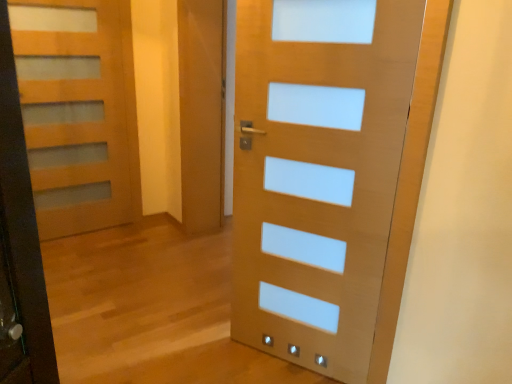
Question: Which direction should I rotate to look at matte wood door at center, marked as the first door in a front-to-back arrangement?

Choices:
 (A) left
 (B) right

Answer: (B)

Question: From the image's perspective, is matte wood door at center, acting as the second door starting from the back, below matte wood door at left, the second door viewed from the right?

Choices:
 (A) no
 (B) yes

Answer: (B)

Question: Is matte wood door at center, marked as the first door in a front-to-back arrangement, oriented towards matte wood door at left, marked as the 1th door in a left-to-right arrangement?

Choices:
 (A) no
 (B) yes

Answer: (A)

Question: Considering the relative sizes of matte wood door at center, acting as the second door starting from the back, and matte wood door at left, which appears as the 1th door when viewed from the back, in the image provided, is matte wood door at center, acting as the second door starting from the back, bigger than matte wood door at left, which appears as the 1th door when viewed from the back,?

Choices:
 (A) yes
 (B) no

Answer: (A)

Question: Is matte wood door at left, marked as the 1th door in a left-to-right arrangement, inside matte wood door at center, marked as the first door in a front-to-back arrangement?

Choices:
 (A) no
 (B) yes

Answer: (A)

Question: Considering the relative sizes of matte wood door at center, arranged as the 1th door when viewed from the right, and matte wood door at left, the second door viewed from the right, in the image provided, is matte wood door at center, arranged as the 1th door when viewed from the right, taller than matte wood door at left, the second door viewed from the right,?

Choices:
 (A) no
 (B) yes

Answer: (A)

Question: Can you confirm if matte wood door at center, arranged as the 1th door when viewed from the right, is thinner than matte wood door at left, the second door viewed from the right?

Choices:
 (A) no
 (B) yes

Answer: (A)

Question: Considering the relative sizes of matte wood door at left, marked as the second door in a front-to-back arrangement, and matte wood door at center, marked as the first door in a front-to-back arrangement, in the image provided, is matte wood door at left, marked as the second door in a front-to-back arrangement, taller than matte wood door at center, marked as the first door in a front-to-back arrangement,?

Choices:
 (A) no
 (B) yes

Answer: (B)

Question: Is matte wood door at left, marked as the 1th door in a left-to-right arrangement, thinner than matte wood door at center, the second door viewed from the left?

Choices:
 (A) no
 (B) yes

Answer: (B)

Question: From a real-world perspective, is matte wood door at left, which appears as the 1th door when viewed from the back, over matte wood door at center, marked as the first door in a front-to-back arrangement?

Choices:
 (A) no
 (B) yes

Answer: (B)

Question: Is matte wood door at left, marked as the second door in a front-to-back arrangement, further to the viewer compared to matte wood door at center, the second door viewed from the left?

Choices:
 (A) yes
 (B) no

Answer: (A)

Question: Considering the relative sizes of matte wood door at left, marked as the 1th door in a left-to-right arrangement, and matte wood door at center, arranged as the 1th door when viewed from the right, in the image provided, is matte wood door at left, marked as the 1th door in a left-to-right arrangement, bigger than matte wood door at center, arranged as the 1th door when viewed from the right,?

Choices:
 (A) no
 (B) yes

Answer: (A)

Question: Is matte wood door at left, the second door viewed from the right, closer to the viewer compared to matte wood door at center, the second door viewed from the left?

Choices:
 (A) no
 (B) yes

Answer: (A)

Question: From a real-world perspective, is matte wood door at left, marked as the second door in a front-to-back arrangement, above or below matte wood door at center, acting as the second door starting from the back?

Choices:
 (A) below
 (B) above

Answer: (B)